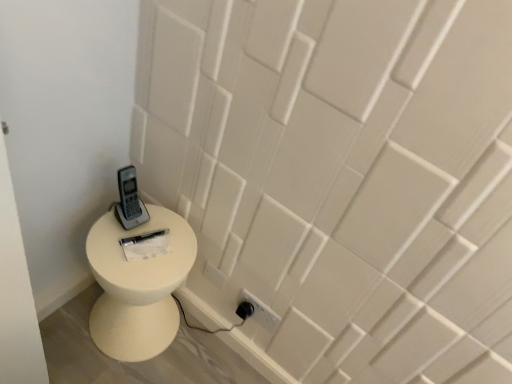
Locate an element on the screen. free space in front of gray plastic phone at upper left is located at coordinates (116, 251).